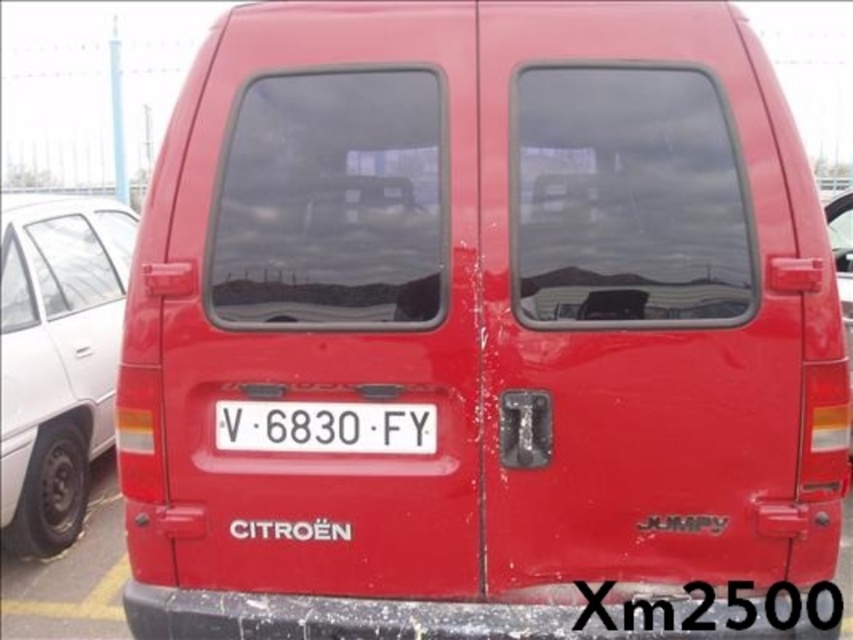
Question: Can you confirm if matte white car at left is smaller than white plastic license plate at center?

Choices:
 (A) no
 (B) yes

Answer: (A)

Question: Can you confirm if matte white car at left is thinner than white plastic license plate at center?

Choices:
 (A) no
 (B) yes

Answer: (B)

Question: Can you confirm if matte white car at left is smaller than white plastic license plate at center?

Choices:
 (A) no
 (B) yes

Answer: (A)

Question: Which of the following is the closest to the observer?

Choices:
 (A) white plastic license plate at center
 (B) matte white car at left

Answer: (A)